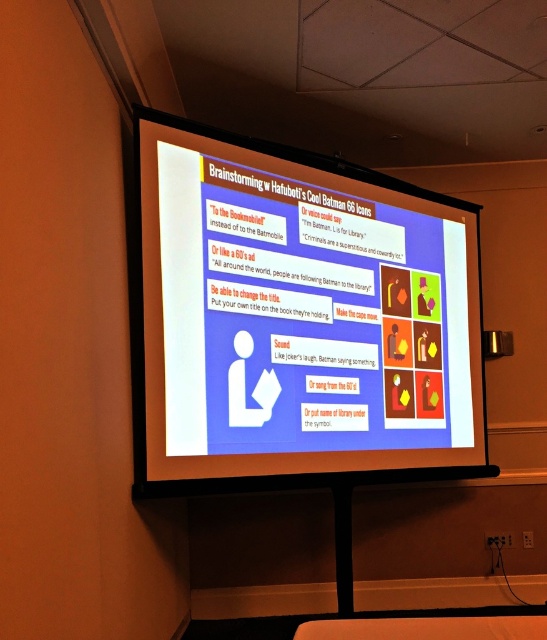
Does white glossy projector screen at center appear over matte black flat at lower center?

Yes.

Who is lower down, white glossy projector screen at center or matte black flat at lower center?

matte black flat at lower center is below.

Between point (253, 323) and point (452, 625), which one is positioned behind?

Positioned behind is point (253, 323).

Locate an element on the screen. white glossy projector screen at center is located at coordinates 295,320.